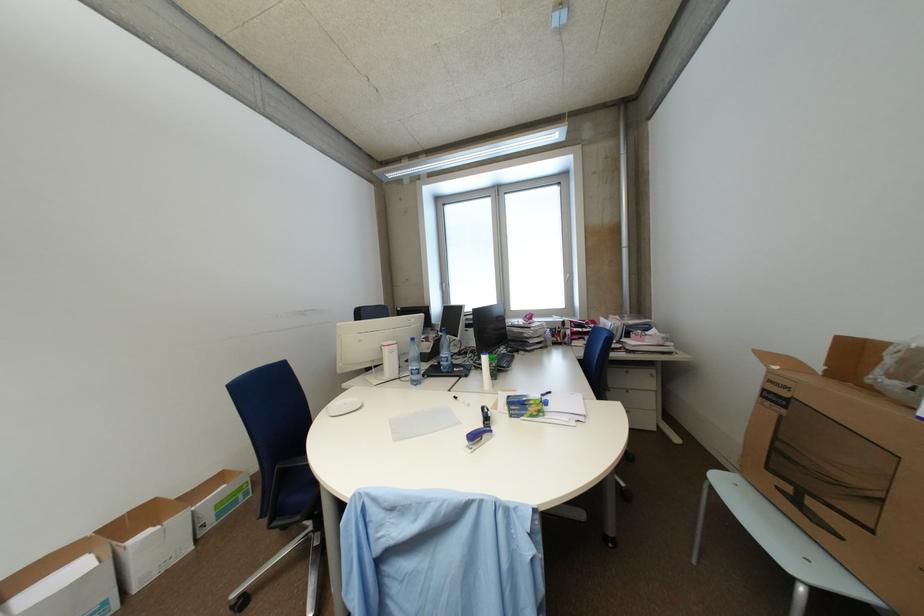
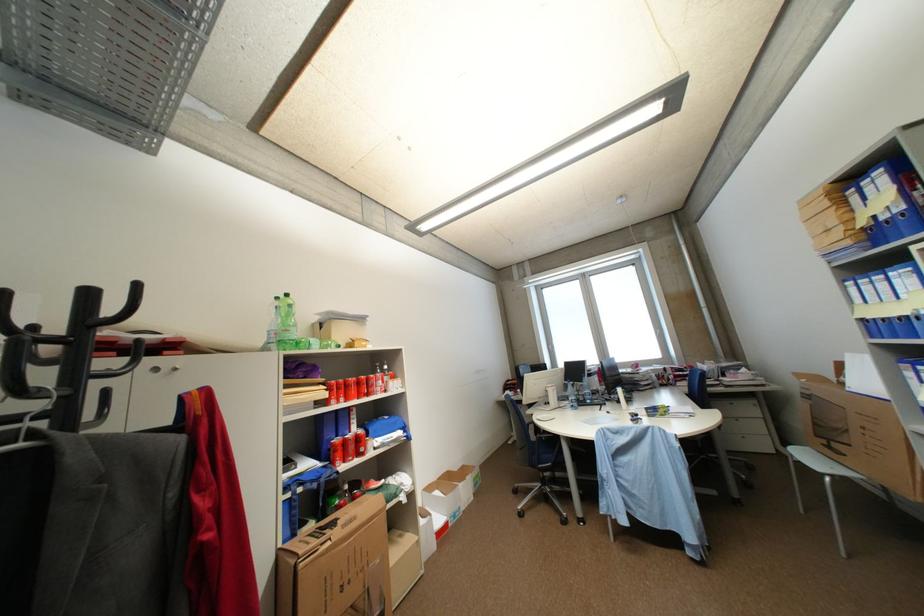
In the second image, find the point that corresponds to the point at 447,363 in the first image.

(587, 400)